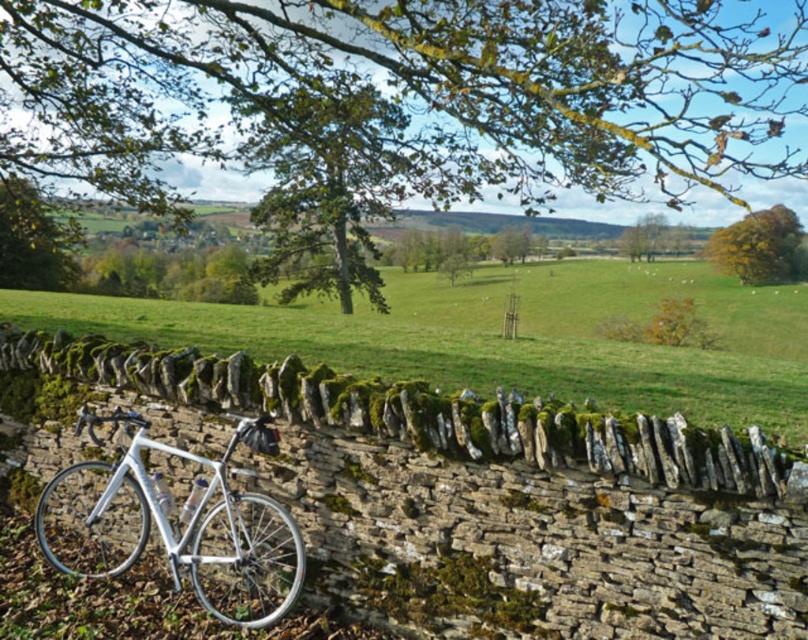
Is white metallic bicycle at lower left to the right of golden-brown textured tree at upper right from the viewer's perspective?

No, white metallic bicycle at lower left is not to the right of golden-brown textured tree at upper right.

Which is more to the right, white metallic bicycle at lower left or golden-brown textured tree at upper right?

Positioned to the right is golden-brown textured tree at upper right.

Locate an element on the screen. This screenshot has height=640, width=808. white metallic bicycle at lower left is located at coordinates (175, 524).

Where is `white metallic bicycle at lower left`? The width and height of the screenshot is (808, 640). white metallic bicycle at lower left is located at coordinates (175, 524).

Which is in front, point (629, 188) or point (266, 620)?

Point (266, 620) is more forward.

Between green leafy tree at center and white metallic bicycle at lower left, which one is positioned lower?

white metallic bicycle at lower left is below.

Is point (548, 88) more distant than point (266, 621)?

Yes, it is.

At what (x,y) coordinates should I click in order to perform the action: click on green leafy tree at center. Please return your answer as a coordinate pair (x, y). Looking at the image, I should click on (406, 92).

Does green leafy tree at center have a greater height compared to green mossy stone wall at lower center?

Correct, green leafy tree at center is much taller as green mossy stone wall at lower center.

Image resolution: width=808 pixels, height=640 pixels. I want to click on green leafy tree at center, so click(406, 92).

The height and width of the screenshot is (640, 808). What do you see at coordinates (406, 92) in the screenshot?
I see `green leafy tree at center` at bounding box center [406, 92].

The height and width of the screenshot is (640, 808). I want to click on green leafy tree at center, so click(406, 92).